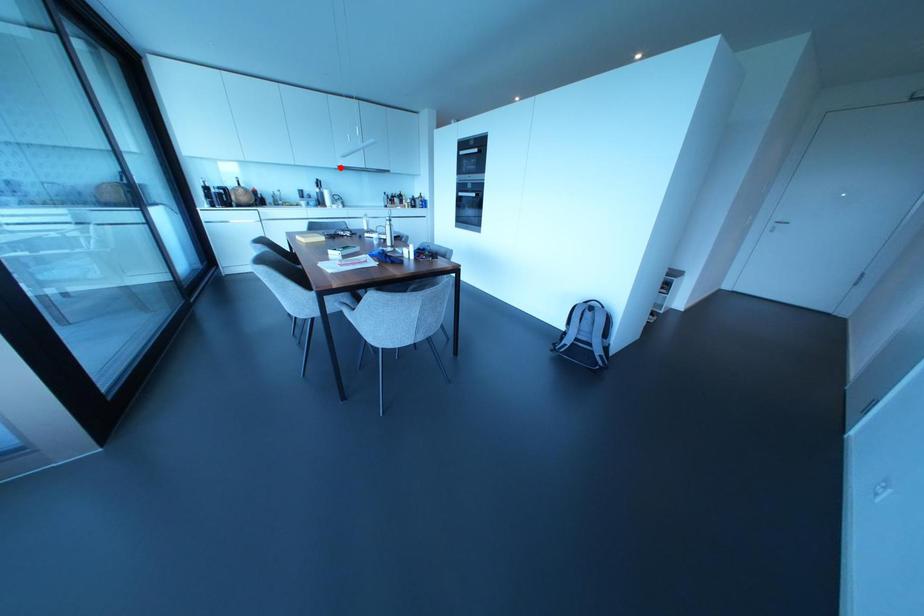
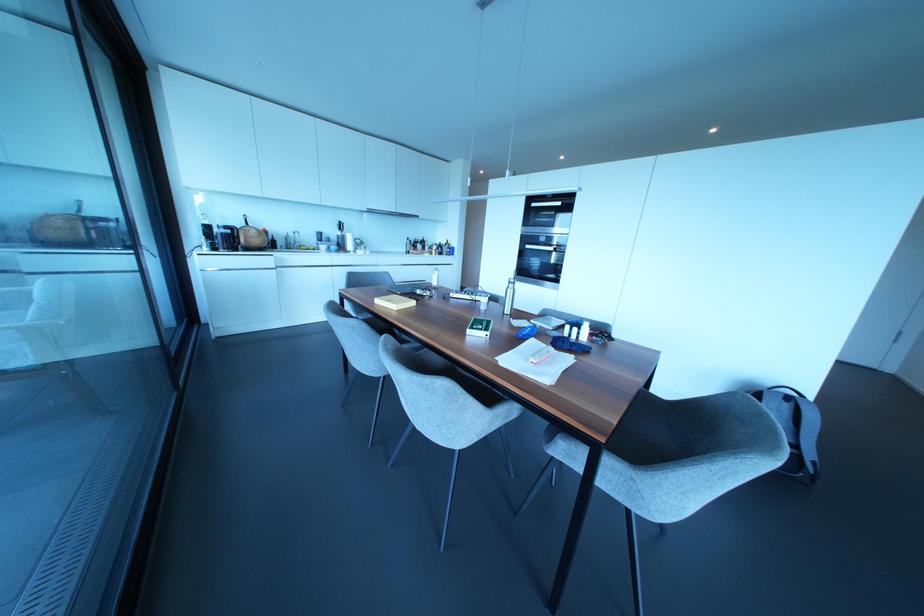
In the second image, find the point that corresponds to the highlighted location in the first image.

(370, 209)